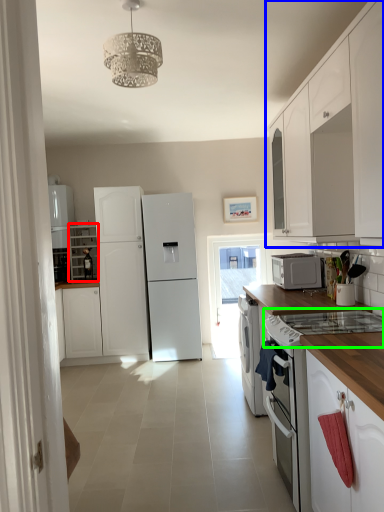
Question: Which is farther away from cabinetry (highlighted by a red box)? cabinetry (highlighted by a blue box) or gas stove (highlighted by a green box)?

Choices:
 (A) cabinetry
 (B) gas stove

Answer: (B)